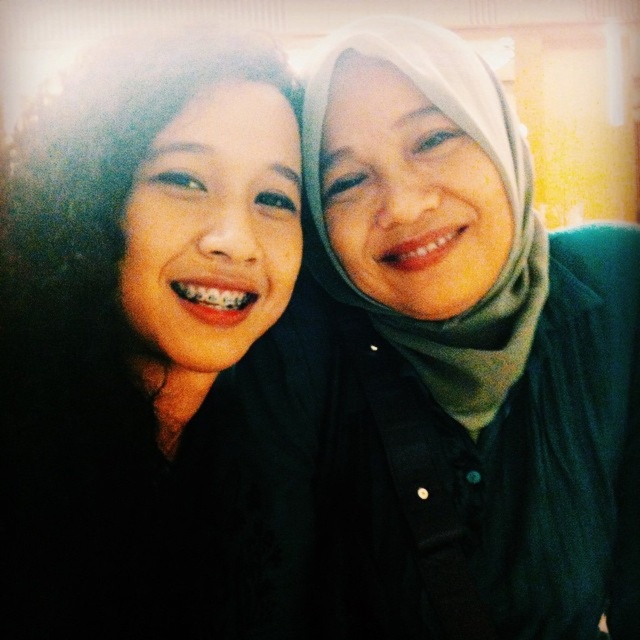
Question: Which object appears closest to the camera in this image?

Choices:
 (A) matte black hijab at upper right
 (B) matte green hijab at upper right

Answer: (A)

Question: Which of the following is the closest to the observer?

Choices:
 (A) (154, 392)
 (B) (502, 550)

Answer: (A)

Question: Which of the following is the farthest from the observer?

Choices:
 (A) (102, 208)
 (B) (588, 356)

Answer: (B)

Question: Is matte green hijab at upper right below matte black hijab at upper right?

Choices:
 (A) no
 (B) yes

Answer: (B)

Question: Considering the relative positions of matte green hijab at upper right and matte black hijab at upper right in the image provided, where is matte green hijab at upper right located with respect to matte black hijab at upper right?

Choices:
 (A) left
 (B) right

Answer: (B)

Question: Is matte green hijab at upper right bigger than matte black hijab at upper right?

Choices:
 (A) yes
 (B) no

Answer: (A)